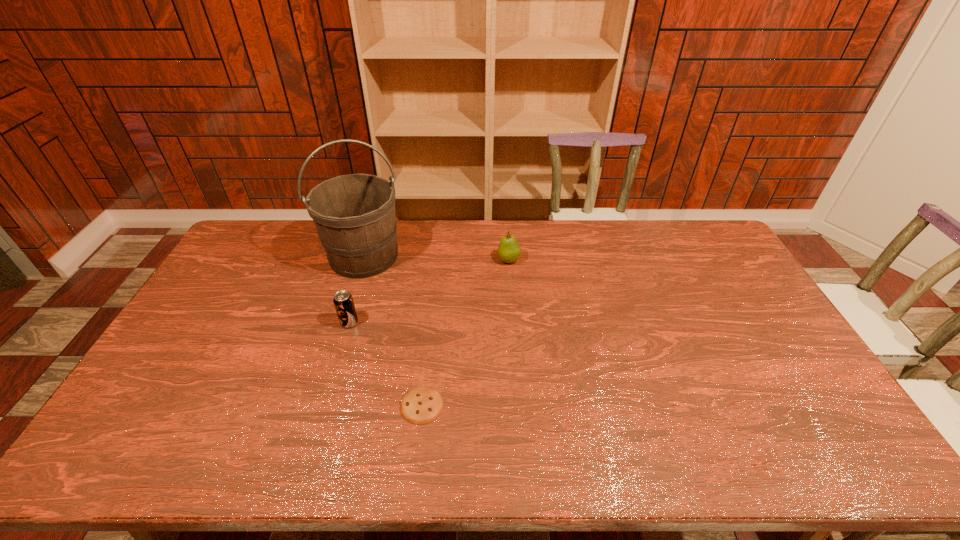
This screenshot has height=540, width=960. I want to click on the tallest object, so click(x=354, y=214).

The image size is (960, 540). I want to click on pear, so click(x=509, y=251).

Identify the location of the third farthest object. The height and width of the screenshot is (540, 960). (343, 301).

At what (x,y) coordinates should I click in order to perform the action: click on the nearest object. Please return your answer as a coordinate pair (x, y). Looking at the image, I should click on (421, 405).

Find the location of a particular element. cookie is located at coordinates (421, 405).

Find the location of `vacant point located 0.080m on the left of the tallest object`. vacant point located 0.080m on the left of the tallest object is located at coordinates (302, 256).

You are a GUI agent. You are given a task and a screenshot of the screen. Output one action in this format:
    pyautogui.click(x=<x>, y=<y>)
    Task: Click on the vacant space located on the right of the rightmost object
    
    Given the screenshot: What is the action you would take?
    pyautogui.click(x=587, y=260)

This screenshot has width=960, height=540. What are the coordinates of `vacant area situated 0.050m on the left of the soda can` in the screenshot? It's located at (324, 322).

Where is `free region located on the left of the third object from left to right`? free region located on the left of the third object from left to right is located at coordinates (335, 405).

Find the location of a particular element. The width and height of the screenshot is (960, 540). bucket situated at the far edge is located at coordinates click(354, 214).